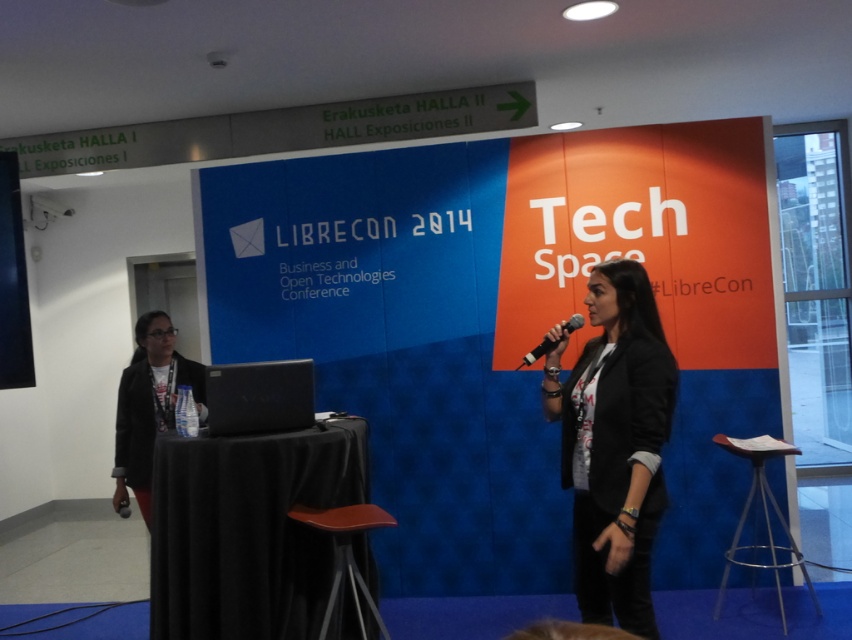
Is wooden stool at center to the left of black matte microphone at center from the viewer's perspective?

Indeed, wooden stool at center is positioned on the left side of black matte microphone at center.

Between wooden stool at center and black matte microphone at center, which one appears on the left side from the viewer's perspective?

wooden stool at center

Is point (361, 518) positioned after point (567, 332)?

No, (361, 518) is closer to viewer.

This screenshot has width=852, height=640. I want to click on wooden stool at center, so click(x=344, y=550).

Locate an element on the screen. Image resolution: width=852 pixels, height=640 pixels. matte black jacket at left is located at coordinates (148, 404).

Is the position of matte black jacket at left more distant than that of wooden stool at center?

Yes, it is.

From the picture: Who is more forward, (114, 506) or (358, 502)?

Point (358, 502) is more forward.

Locate an element on the screen. Image resolution: width=852 pixels, height=640 pixels. matte black jacket at left is located at coordinates (148, 404).

Between black matte blazer at center and black matte microphone at center, which one has more height?

black matte blazer at center

Can you confirm if black matte blazer at center is shorter than black matte microphone at center?

Incorrect, black matte blazer at center's height does not fall short of black matte microphone at center's.

I want to click on black matte blazer at center, so click(x=614, y=444).